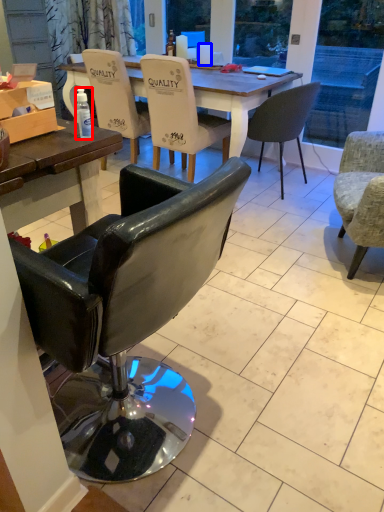
Question: Among these objects, which one is farthest to the camera, bottle (highlighted by a red box) or coffee cup (highlighted by a blue box)?

Choices:
 (A) bottle
 (B) coffee cup

Answer: (B)